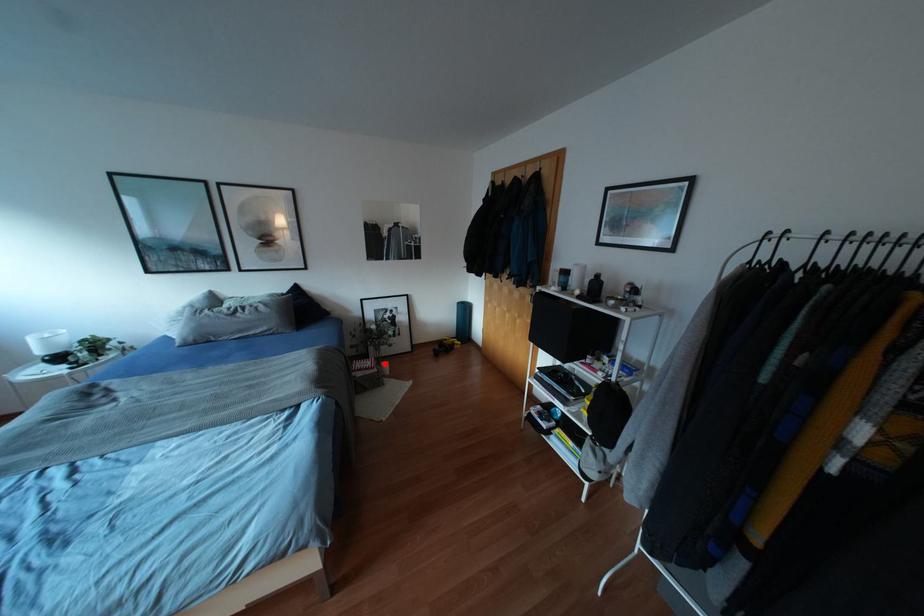
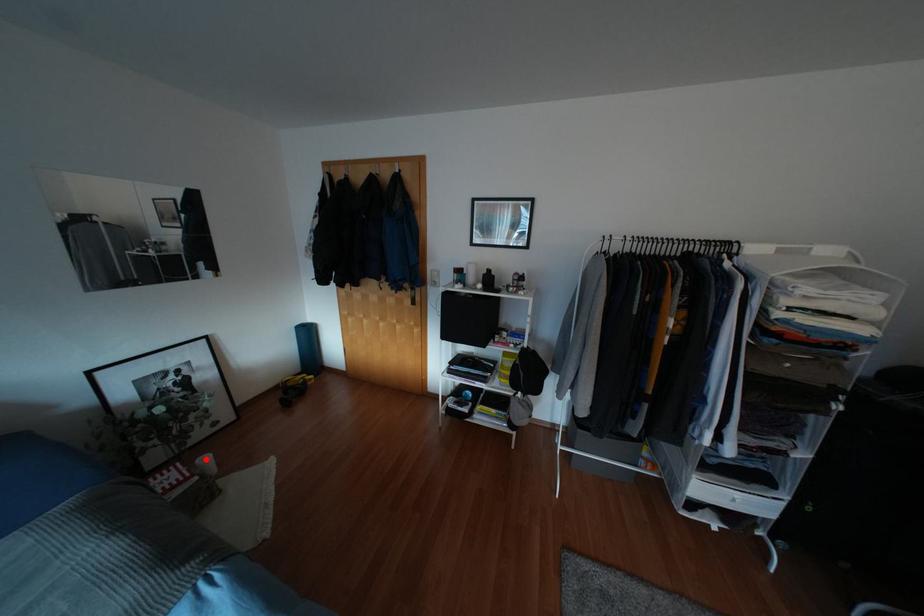
Based on the photo, I am providing you with two images of the same scene from different viewpoints. A red point is marked on the first image and another point is marked on the second image. Is the red point in image1 aligned with the point shown in image2?

Yes